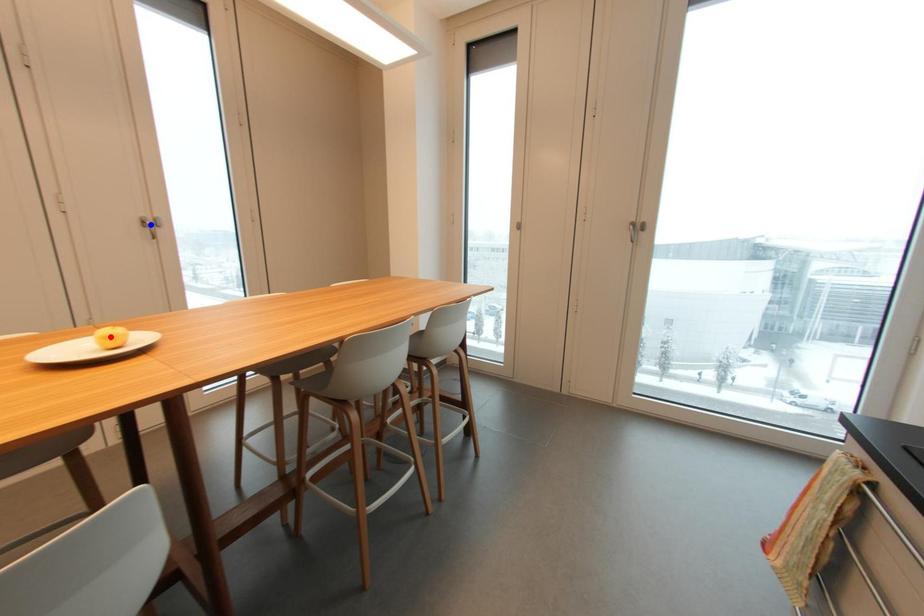
Question: Which of the two points in the image is closer to the camera?

Choices:
 (A) Blue point is closer.
 (B) Red point is closer.

Answer: (B)